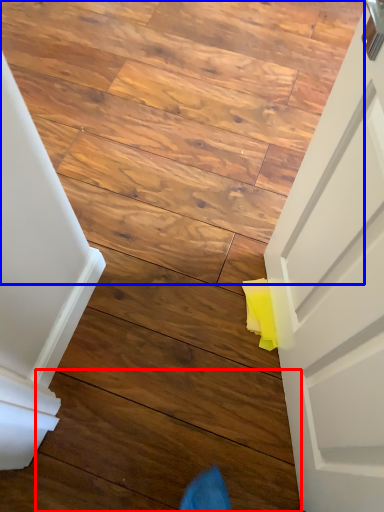
Question: Among these objects, which one is nearest to the camera, plank (highlighted by a red box) or stairwell (highlighted by a blue box)?

Choices:
 (A) plank
 (B) stairwell

Answer: (A)